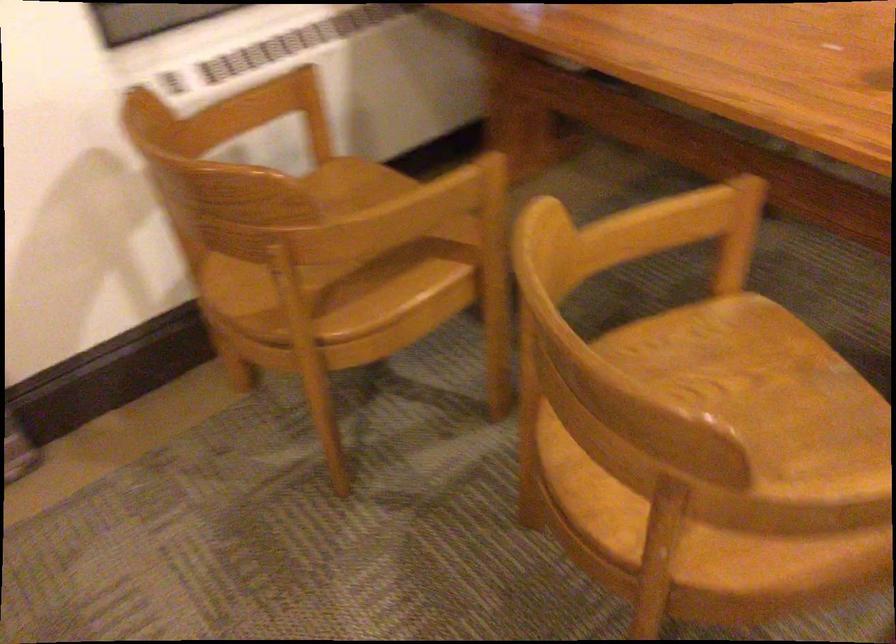
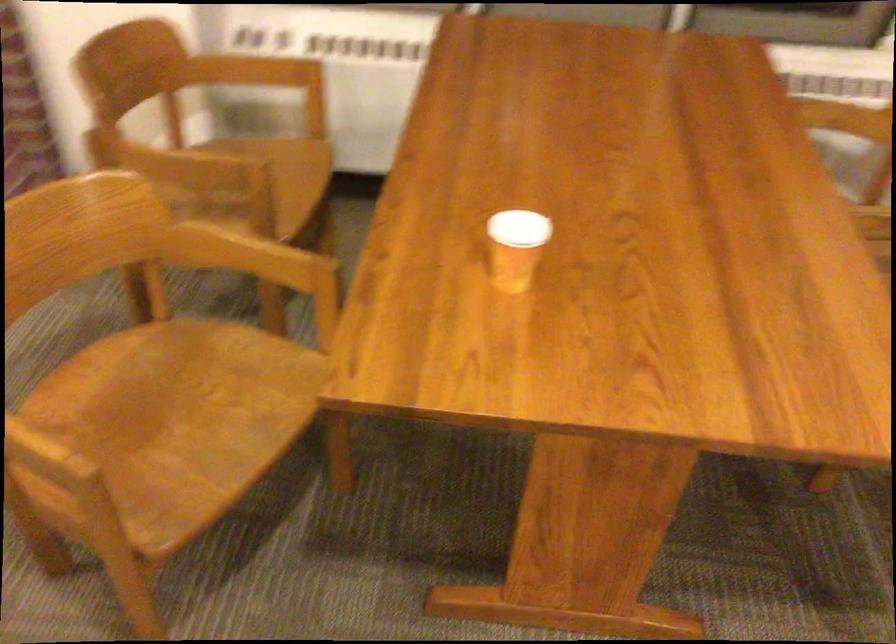
Find the pixel in the second image that matches point (409, 210) in the first image.

(169, 163)